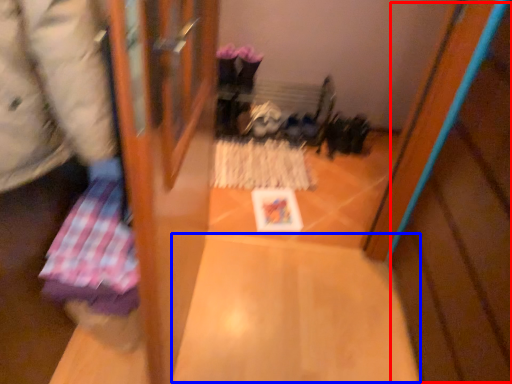
Question: Which object is closer to the camera taking this photo, wood (highlighted by a red box) or wide (highlighted by a blue box)?

Choices:
 (A) wood
 (B) wide

Answer: (A)